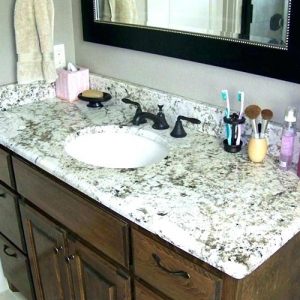
You are a GUI agent. You are given a task and a screenshot of the screen. Output one action in this format:
    pyautogui.click(x=<x>, y=<y>)
    Task: Click on the cold water handle
    This screenshot has width=300, height=300.
    Given the screenshot: What is the action you would take?
    pyautogui.click(x=191, y=118)